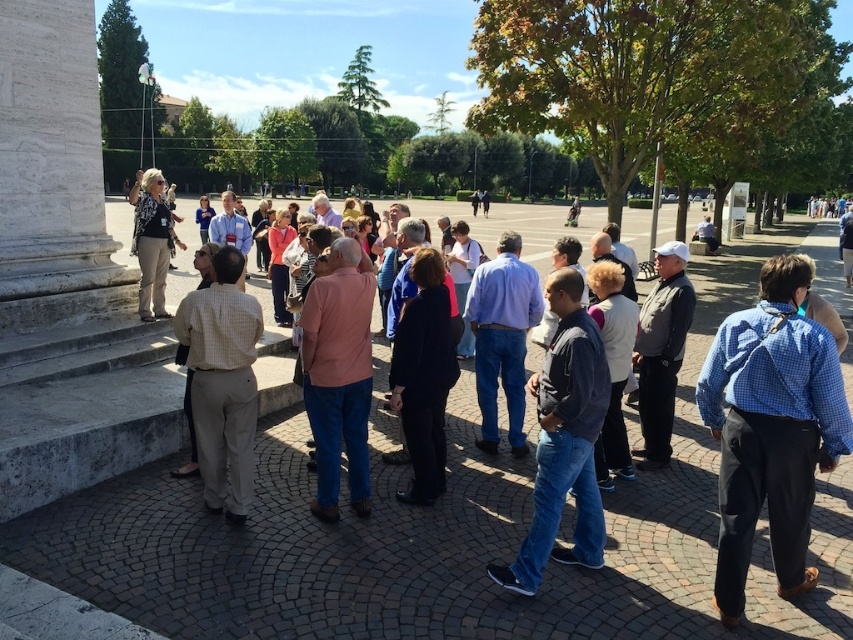
You are a photographer positioned at the origin point of the image. You want to capture a photo of the denim jeans at center. What are the coordinates you should aim for?

The denim jeans at center are located at coordinates point [564,442], so you should aim for point [564,442].

You are a photographer trying to capture a photo of the matte pink sweater at center without including the dark blue fabric coat at center in the frame. Based on their positions, is this possible?

The dark blue fabric coat at center is in front of the matte pink sweater at center, so it would block the view. Therefore, it is not possible to capture the matte pink sweater at center without the dark blue fabric coat at center appearing in the frame.